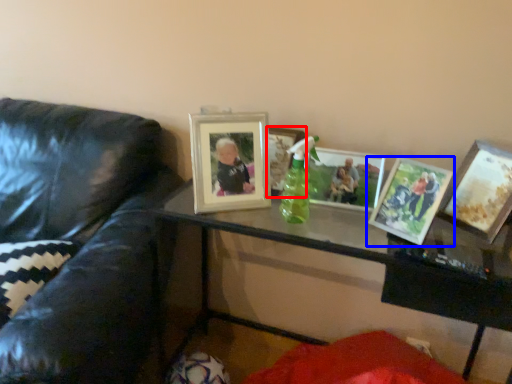
Question: Which object appears closest to the camera in this image, picture frame (highlighted by a red box) or picture frame (highlighted by a blue box)?

Choices:
 (A) picture frame
 (B) picture frame

Answer: (B)